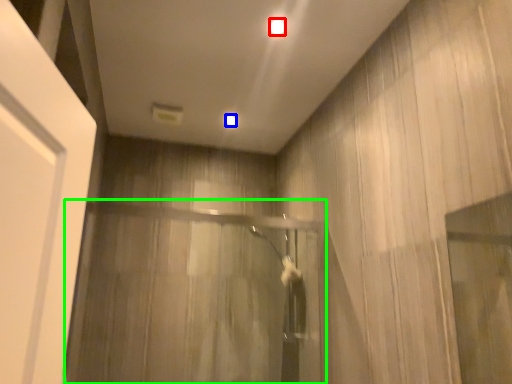
Question: Which object is the farthest from lighting (highlighted by a red box)? Choose among these: lighting (highlighted by a blue box) or screen door (highlighted by a green box).

Choices:
 (A) lighting
 (B) screen door

Answer: (B)